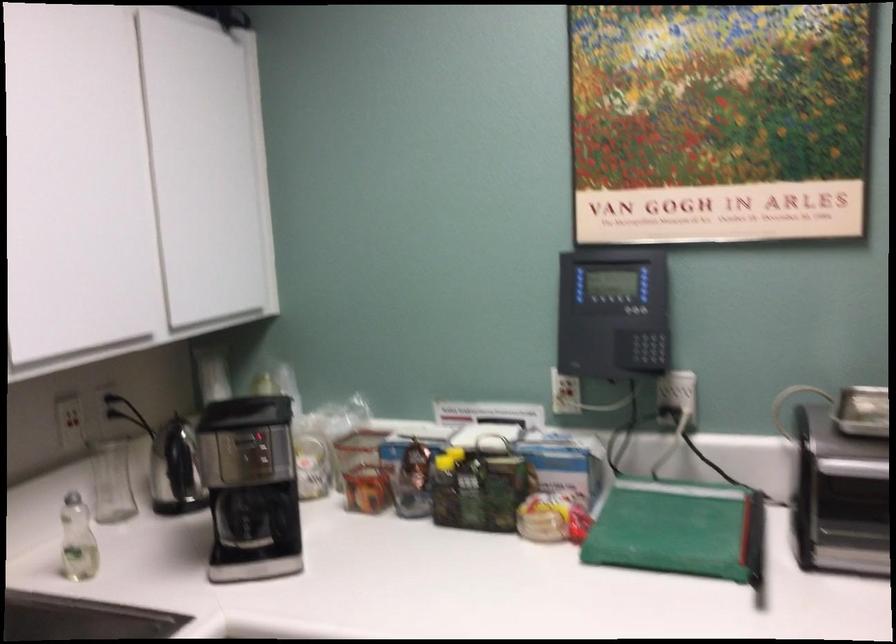
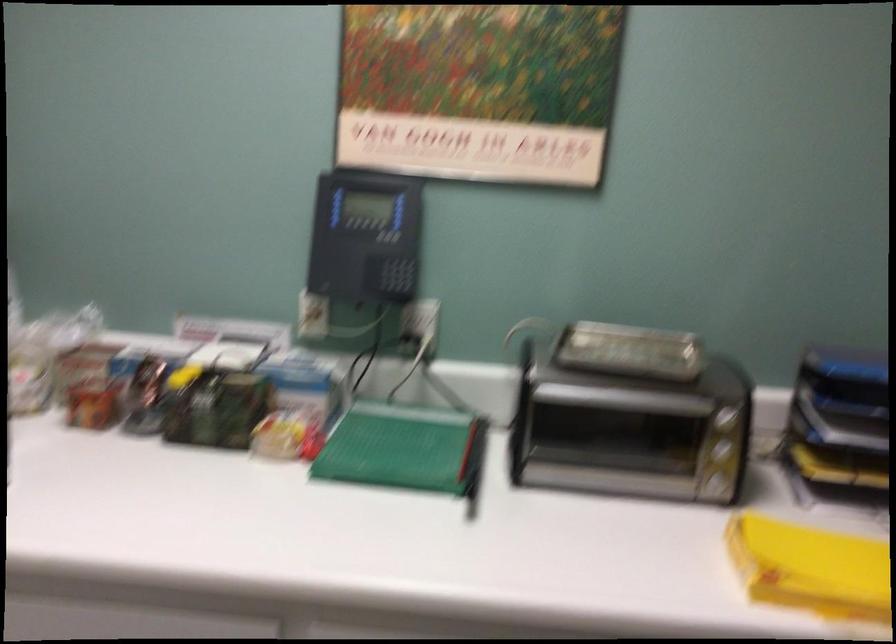
What movement of the cameraman would produce the second image?

The cameraman moved toward right, backward.